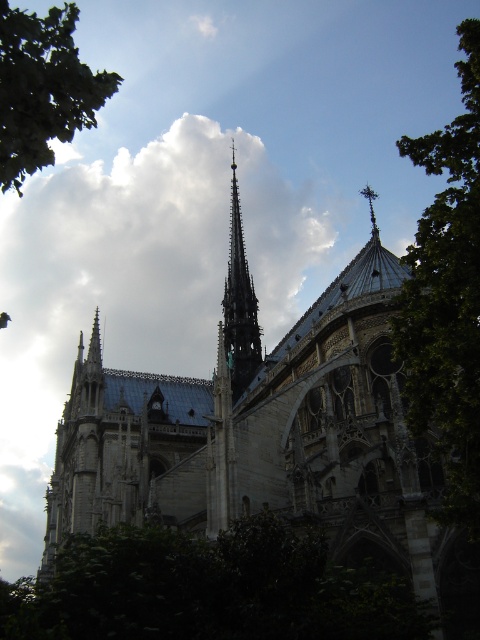
You are an architect analyzing the cathedral. From your viewpoint, does the stone gothic cathedral at center appear to be directly below the white fluffy cloud at upper center?

Yes, the stone gothic cathedral at center is positioned under the white fluffy cloud at upper center, so it appears directly below it from this viewpoint.

You are standing in front of the cathedral and notice a green leafy tree at lower center and a polished silver spire at upper right. Which object is taller?

The green leafy tree at lower center is taller than the polished silver spire at upper right.

You are standing at the entrance of the cathedral and notice two points marked on the cathedral facade. The first point is at coordinates point (360, 541) and the second is at point (195, 188). From your vantage point, which point appears closer to you?

Point (360, 541) appears closer to you because it is in front of point (195, 188).